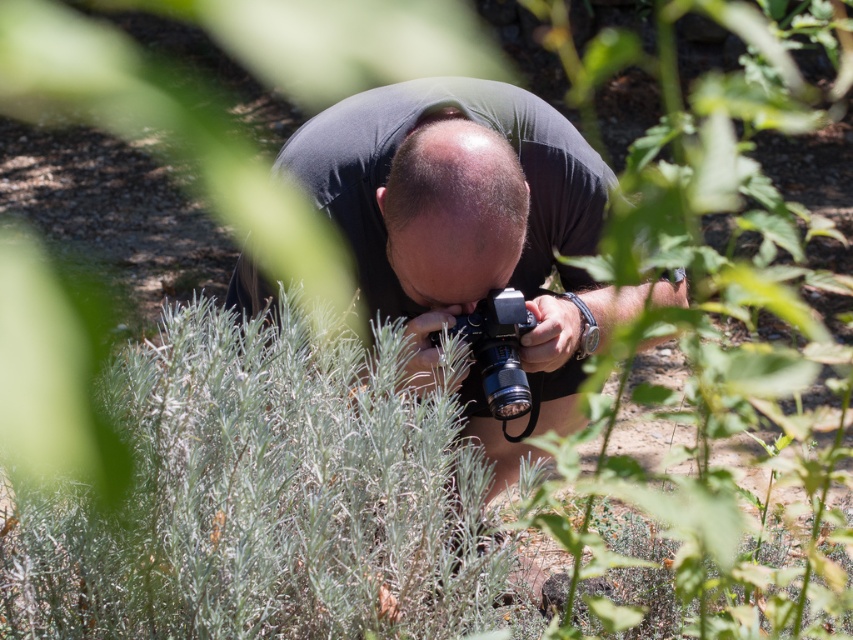
Does black matte camera at center lie behind black plastic camera at center?

No, it is in front of black plastic camera at center.

Is black matte camera at center smaller than black plastic camera at center?

No.

Between point (357, 131) and point (503, 420), which one is positioned behind?

The point (503, 420) is behind.

The image size is (853, 640). Find the location of `black matte camera at center`. black matte camera at center is located at coordinates (467, 220).